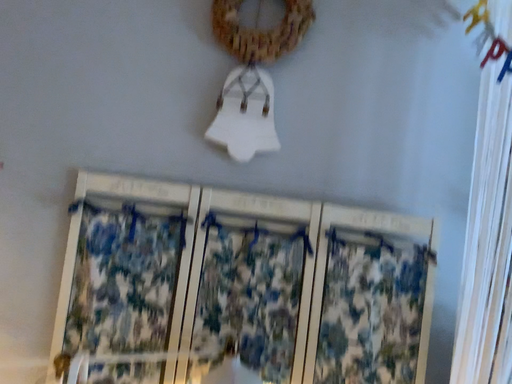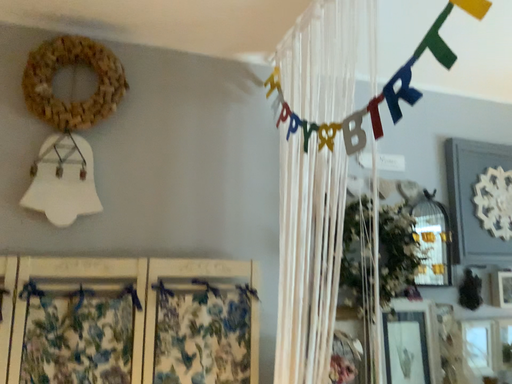
Question: How did the camera likely rotate when shooting the video?

Choices:
 (A) rotated right
 (B) rotated left

Answer: (A)